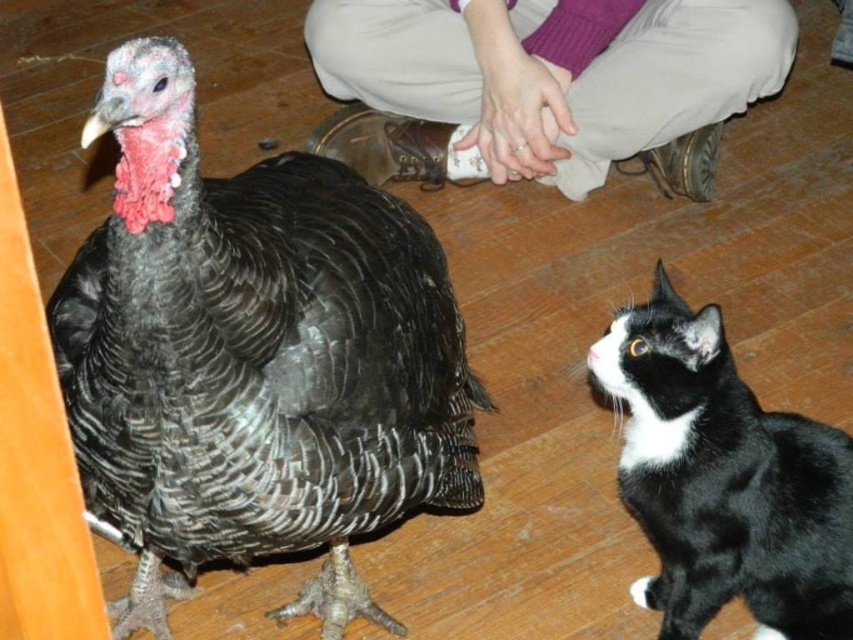
Is beige fabric pants at upper center positioned at the back of black and white fur cat at lower right?

Yes, it is behind black and white fur cat at lower right.

Is beige fabric pants at upper center wider than black and white fur cat at lower right?

Yes.

Between point (560, 24) and point (659, 344), which one is positioned behind?

The point (560, 24) is behind.

I want to click on beige fabric pants at upper center, so click(554, 72).

Can you confirm if black textured turkey at center is taller than beige fabric pants at upper center?

Yes.

Does black textured turkey at center have a lesser width compared to beige fabric pants at upper center?

Correct, black textured turkey at center's width is less than beige fabric pants at upper center's.

Between point (90, 428) and point (738, 88), which one is positioned in front?

Point (90, 428) is in front.

You are a GUI agent. You are given a task and a screenshot of the screen. Output one action in this format:
    pyautogui.click(x=<x>, y=<y>)
    Task: Click on the black textured turkey at center
    The width and height of the screenshot is (853, 640).
    Given the screenshot: What is the action you would take?
    pyautogui.click(x=253, y=356)

Measure the distance between black textured turkey at center and black and white fur cat at lower right.

The distance of black textured turkey at center from black and white fur cat at lower right is 18.37 inches.

Identify the location of black textured turkey at center. (253, 356).